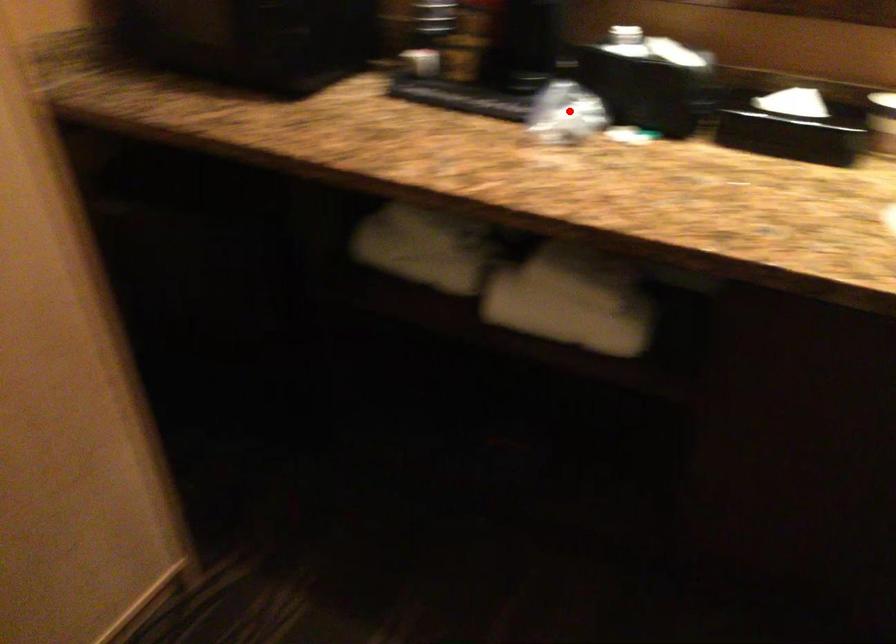
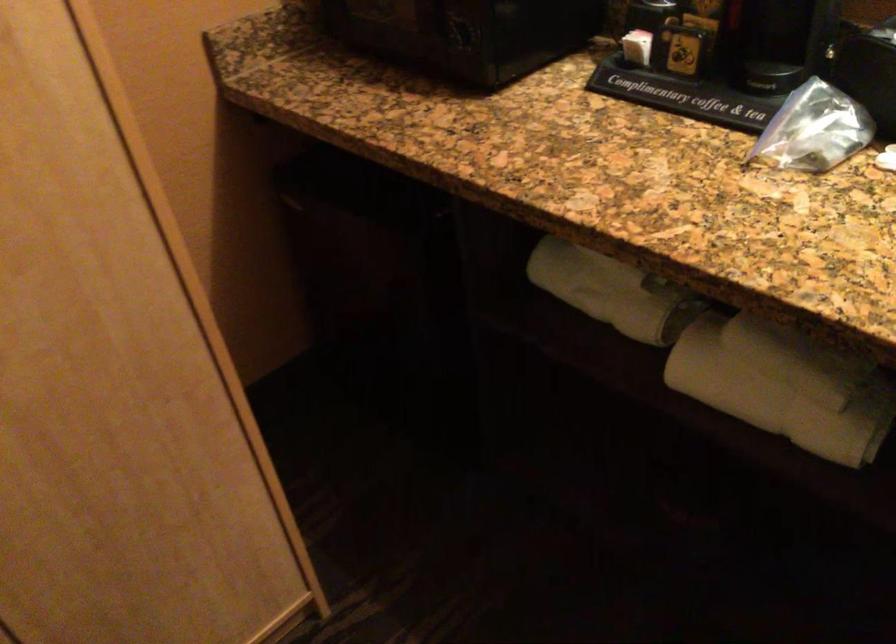
Question: I am providing you with two images of the same scene from different viewpoints. A red point is shown in image1. For the corresponding object point in image2, is it positioned nearer or farther from the camera?

Choices:
 (A) Nearer
 (B) Farther

Answer: (A)